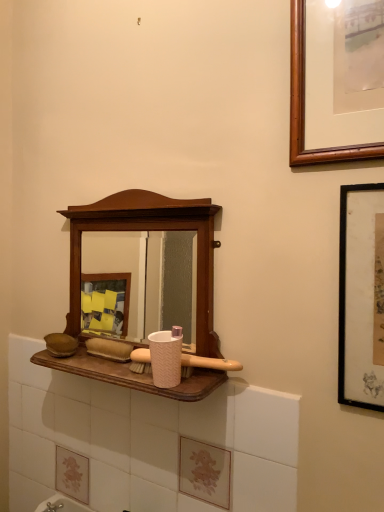
Where is `black matte picture frame at right`? The height and width of the screenshot is (512, 384). black matte picture frame at right is located at coordinates (361, 296).

Identify the location of wooden medicine cabinet at center. The image size is (384, 512). (197, 283).

Identify the location of pink textured brush at center. The image size is (384, 512). (210, 362).

Where is `black matte picture frame at right`? The height and width of the screenshot is (512, 384). black matte picture frame at right is located at coordinates (361, 296).

Is pink textured brush at center looking in the opposite direction of pink textured cup at center?

No, pink textured brush at center is not facing the opposite direction of pink textured cup at center.

Is pink textured brush at center positioned far away from pink textured cup at center?

No, pink textured brush at center is not far away from pink textured cup at center.

Image resolution: width=384 pixels, height=512 pixels. In order to click on toiletry above the pink textured brush at center (from the image's perspective) in this screenshot , I will do `click(166, 357)`.

Is point (230, 365) closer to camera compared to point (153, 352)?

No.

From the image's perspective, is black matte picture frame at right under pink textured cup at center?

No, from the image's perspective, black matte picture frame at right is not below pink textured cup at center.

In terms of width, does black matte picture frame at right look wider or thinner when compared to pink textured cup at center?

In the image, black matte picture frame at right appears to be more narrow than pink textured cup at center.

How different are the orientations of black matte picture frame at right and pink textured cup at center in degrees?

0.567 degrees separate the facing orientations of black matte picture frame at right and pink textured cup at center.

In the scene shown: Is black matte picture frame at right completely or partially outside of pink textured cup at center?

Yes, black matte picture frame at right is not within pink textured cup at center.

Is pink textured cup at center oriented towards pink textured brush at center?

No, pink textured cup at center does not turn towards pink textured brush at center.

Which point is more distant from viewer, (173, 344) or (136, 360)?

The point (136, 360) is farther.

From the image's perspective, which object appears higher, pink textured cup at center or pink textured brush at center?

pink textured cup at center.

Which object is further away from the camera taking this photo, pink textured cup at center or pink textured brush at center?

pink textured brush at center.

I want to click on brush below the black matte picture frame at right (from a real-world perspective), so click(x=210, y=362).

Is black matte picture frame at right oriented towards pink textured brush at center?

No, black matte picture frame at right is not turned towards pink textured brush at center.

Can pink textured brush at center be found inside black matte picture frame at right?

No, pink textured brush at center is not a part of black matte picture frame at right.

Considering the relative sizes of black matte picture frame at right and wooden medicine cabinet at center in the image provided, is black matte picture frame at right shorter than wooden medicine cabinet at center?

Yes.

In the scene shown: Would you say black matte picture frame at right is outside wooden medicine cabinet at center?

Yes, black matte picture frame at right is outside of wooden medicine cabinet at center.

Which object is closer to the camera taking this photo, black matte picture frame at right or wooden medicine cabinet at center?

black matte picture frame at right is closer to the camera.

Could you tell me if black matte picture frame at right is turned towards wooden medicine cabinet at center?

No, black matte picture frame at right is not oriented towards wooden medicine cabinet at center.

In the image, is wooden medicine cabinet at center positioned in front of or behind pink textured cup at center?

In the image, wooden medicine cabinet at center appears in front of pink textured cup at center.

In terms of width, does wooden medicine cabinet at center look wider or thinner when compared to pink textured cup at center?

In the image, wooden medicine cabinet at center appears to be wider than pink textured cup at center.

From a real-world perspective, is wooden medicine cabinet at center over pink textured cup at center?

Yes, from a real-world perspective, wooden medicine cabinet at center is over pink textured cup at center

Find the location of a particular element. This screenshot has width=384, height=512. toiletry behind the wooden medicine cabinet at center is located at coordinates (166, 357).

Which of these two, pink textured cup at center or wooden medicine cabinet at center, is bigger?

wooden medicine cabinet at center.

From a real-world perspective, is pink textured cup at center on top of wooden medicine cabinet at center?

No.

Can you confirm if pink textured cup at center is taller than wooden medicine cabinet at center?

No, pink textured cup at center is not taller than wooden medicine cabinet at center.

How far apart are pink textured cup at center and wooden medicine cabinet at center?

7.92 inches.

You are a GUI agent. You are given a task and a screenshot of the screen. Output one action in this format:
    pyautogui.click(x=<x>, y=<y>)
    Task: Click on the brush behind the pink textured cup at center
    Image resolution: width=384 pixels, height=512 pixels.
    Given the screenshot: What is the action you would take?
    pyautogui.click(x=210, y=362)

In order to click on picture frame in front of the pink textured cup at center in this screenshot , I will do `click(361, 296)`.

From the image, which object appears to be farther from wooden medicine cabinet at center, pink textured cup at center or black matte picture frame at right?

black matte picture frame at right lies further to wooden medicine cabinet at center than the other object.

Based on their spatial positions, is wooden medicine cabinet at center or black matte picture frame at right further from pink textured brush at center?

Among the two, black matte picture frame at right is located further to pink textured brush at center.

Which object lies further to the anchor point wooden medicine cabinet at center, pink textured brush at center or black matte picture frame at right?

Based on the image, black matte picture frame at right appears to be further to wooden medicine cabinet at center.

Looking at the image, which one is located closer to black matte picture frame at right, wooden medicine cabinet at center or pink textured cup at center?

Based on the image, pink textured cup at center appears to be nearer to black matte picture frame at right.

Considering their positions, is pink textured brush at center positioned further to black matte picture frame at right than pink textured cup at center?

Among the two, pink textured cup at center is located further to black matte picture frame at right.

Which object lies further to the anchor point black matte picture frame at right, pink textured brush at center or wooden medicine cabinet at center?

Among the two, wooden medicine cabinet at center is located further to black matte picture frame at right.

When comparing their distances from pink textured cup at center, does black matte picture frame at right or wooden medicine cabinet at center seem closer?

wooden medicine cabinet at center is positioned closer to the anchor pink textured cup at center.

Considering their positions, is pink textured cup at center positioned closer to wooden medicine cabinet at center than pink textured brush at center?

pink textured cup at center is positioned closer to the anchor wooden medicine cabinet at center.

Locate an element on the screen. Image resolution: width=384 pixels, height=512 pixels. toiletry between wooden medicine cabinet at center and black matte picture frame at right in the horizontal direction is located at coordinates (166, 357).

Where is `brush between wooden medicine cabinet at center and black matte picture frame at right`? The height and width of the screenshot is (512, 384). brush between wooden medicine cabinet at center and black matte picture frame at right is located at coordinates (210, 362).

Identify the location of toiletry that lies between wooden medicine cabinet at center and pink textured brush at center from top to bottom. The height and width of the screenshot is (512, 384). (166, 357).

What are the coordinates of `brush between pink textured cup at center and black matte picture frame at right from left to right` in the screenshot? It's located at (210, 362).